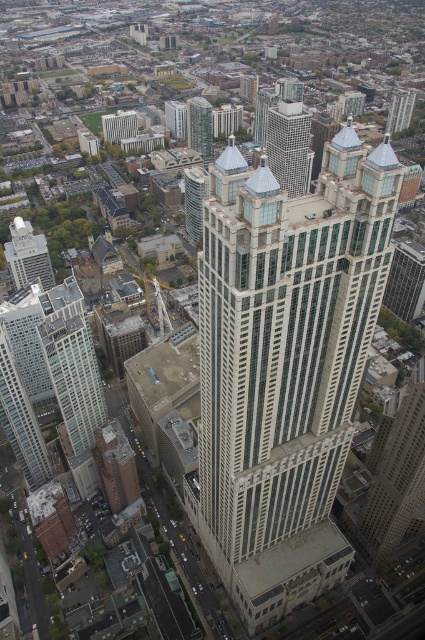
You are a city planner analyzing the urban layout. Given the aerial view, which skyscraper occupies more horizontal space in the city? The glassy steel skyscraper at center or the matte glass skyscraper at lower left?

The glassy steel skyscraper at center might be wider than matte glass skyscraper at lower left, so it likely occupies more horizontal space in the city.

You are a drone operator flying a drone that needs to capture a photo of the glassy reflective skyscraper at upper center. However, you must ensure that the glassy steel skyscraper at center does not block the view. From your current position, can you adjust your drone to take the photo without obstruction?

The glassy steel skyscraper at center is closer to the viewer than the glassy reflective skyscraper at upper center, so the glassy steel skyscraper at center will block the view of the glassy reflective skyscraper at upper center. You need to adjust your drone to fly around or above the glassy steel skyscraper at center to avoid obstruction.